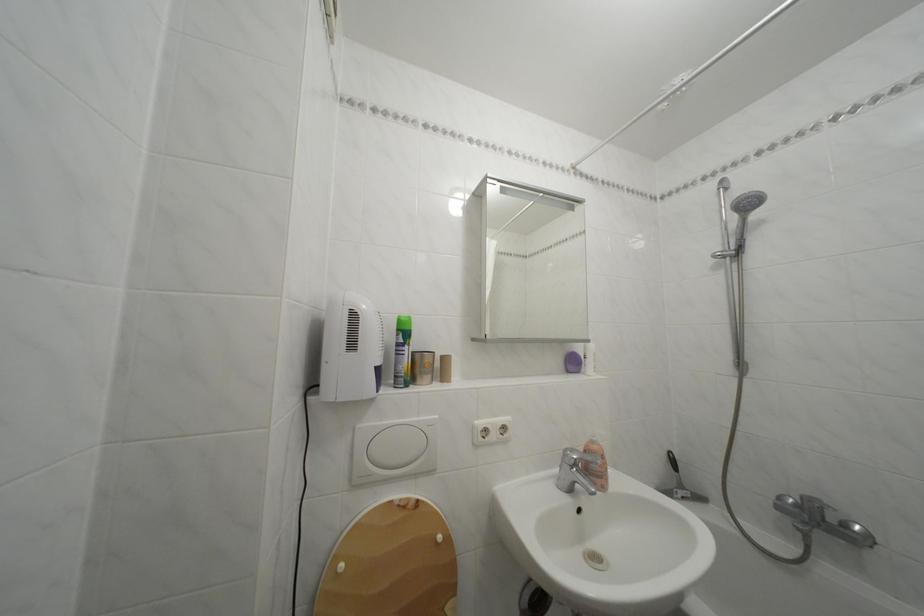
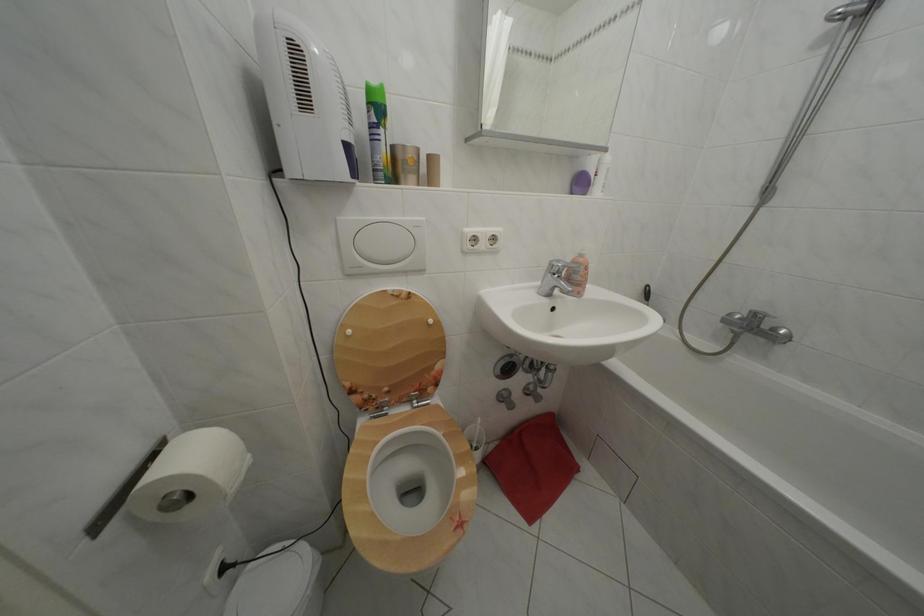
Find the pixel in the second image that matches point 407,336 in the first image.

(378, 110)